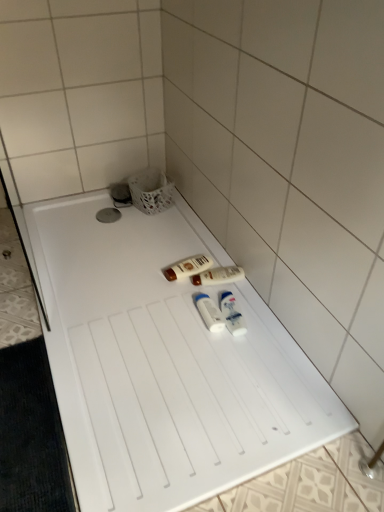
The height and width of the screenshot is (512, 384). I want to click on free spot behind white glossy lotion at center, the third toiletry from the front, so click(x=199, y=252).